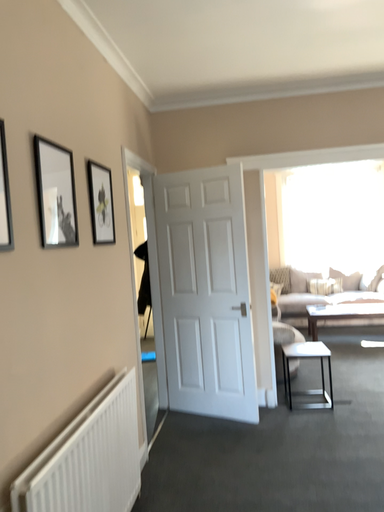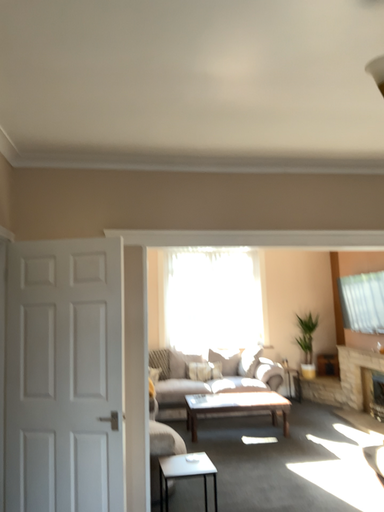
Question: Which way did the camera rotate in the video?

Choices:
 (A) rotated upward
 (B) rotated downward

Answer: (A)